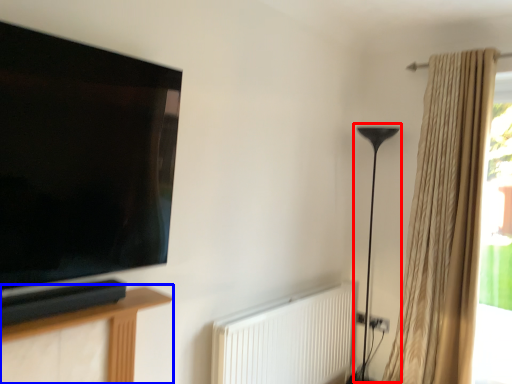
Question: Which object appears farthest to the camera in this image, table lamp (highlighted by a red box) or furniture (highlighted by a blue box)?

Choices:
 (A) table lamp
 (B) furniture

Answer: (A)